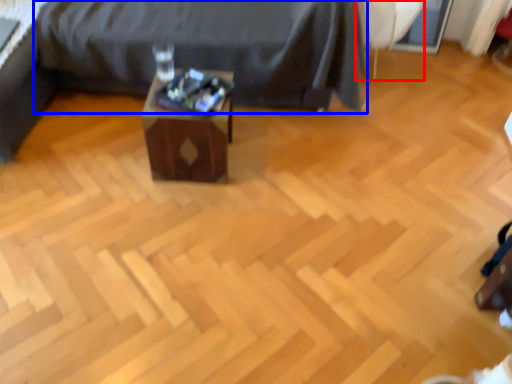
Question: Which of the following is the farthest to the observer, swivel chair (highlighted by a red box) or furniture (highlighted by a blue box)?

Choices:
 (A) swivel chair
 (B) furniture

Answer: (A)